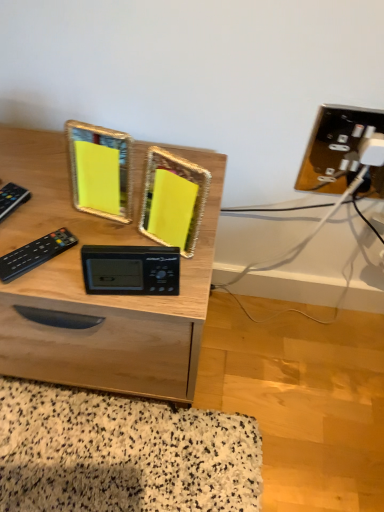
Identify the location of vacant space situated on the left part of black plastic clock at center. The height and width of the screenshot is (512, 384). (54, 252).